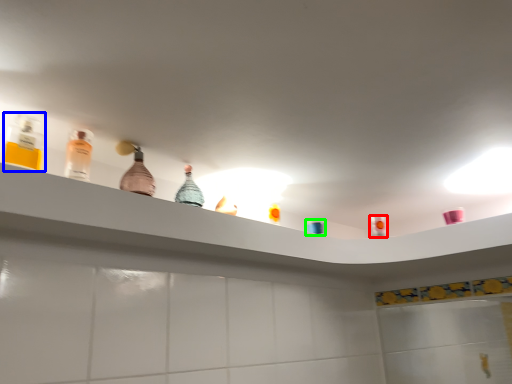
Question: Which is nearer to the mouthwash (highlighted by a red box)? bottle (highlighted by a blue box) or toiletry (highlighted by a green box).

Choices:
 (A) bottle
 (B) toiletry

Answer: (B)